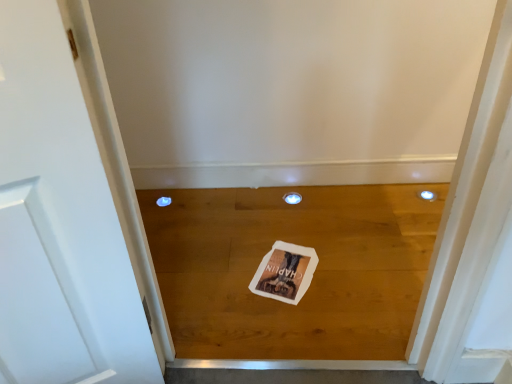
Question: Is wooden floor at center at the right side of white paper postcard at center?

Choices:
 (A) yes
 (B) no

Answer: (A)

Question: Is wooden floor at center positioned far away from white paper postcard at center?

Choices:
 (A) no
 (B) yes

Answer: (A)

Question: From a real-world perspective, is wooden floor at center on white paper postcard at center?

Choices:
 (A) no
 (B) yes

Answer: (A)

Question: Is wooden floor at center bigger than white paper postcard at center?

Choices:
 (A) no
 (B) yes

Answer: (B)

Question: Can you confirm if wooden floor at center is thinner than white paper postcard at center?

Choices:
 (A) yes
 (B) no

Answer: (B)

Question: Is white paper postcard at center at the back of wooden floor at center?

Choices:
 (A) yes
 (B) no

Answer: (A)

Question: Does white paper postcard at center touch wooden floor at center?

Choices:
 (A) yes
 (B) no

Answer: (B)

Question: Considering the relative positions of white paper postcard at center and wooden floor at center in the image provided, is white paper postcard at center to the right of wooden floor at center from the viewer's perspective?

Choices:
 (A) no
 (B) yes

Answer: (A)

Question: From a real-world perspective, is white paper postcard at center physically above wooden floor at center?

Choices:
 (A) no
 (B) yes

Answer: (B)

Question: Is white paper postcard at center shorter than wooden floor at center?

Choices:
 (A) yes
 (B) no

Answer: (A)

Question: Is white paper postcard at center at the left side of wooden floor at center?

Choices:
 (A) no
 (B) yes

Answer: (B)

Question: Does white paper postcard at center come behind wooden floor at center?

Choices:
 (A) yes
 (B) no

Answer: (A)

Question: Relative to white paper postcard at center, is wooden floor at center in front or behind?

Choices:
 (A) front
 (B) behind

Answer: (A)